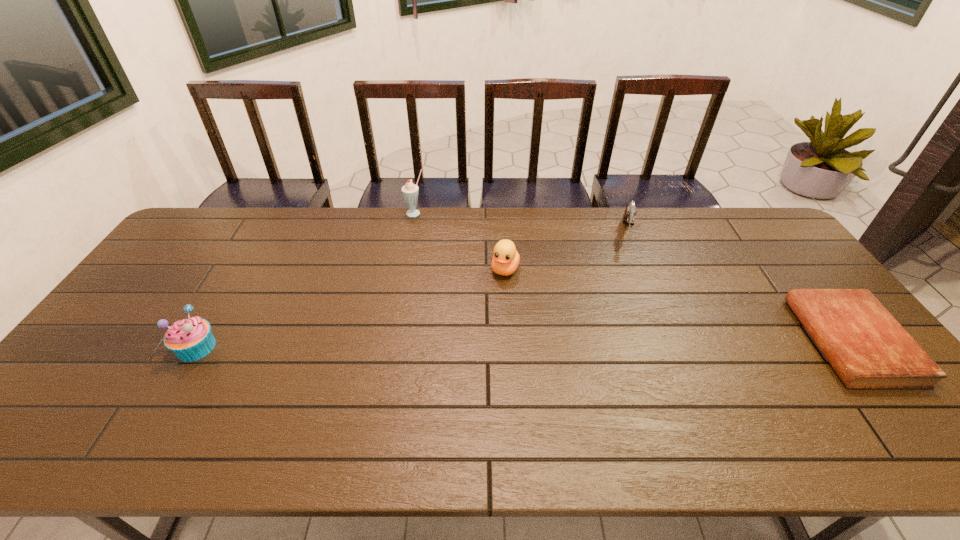
Image resolution: width=960 pixels, height=540 pixels. Identify the location of vacant region located on the spine side of the rightmost object. [683, 341].

Find the location of a particular element. free space located 0.070m on the spine side of the rightmost object is located at coordinates (783, 341).

Locate an element on the screen. The width and height of the screenshot is (960, 540). vacant space located on the straw side of the milkshake is located at coordinates (434, 265).

The height and width of the screenshot is (540, 960). What are the coordinates of `free space located on the straw side of the milkshake` in the screenshot? It's located at (443, 291).

The height and width of the screenshot is (540, 960). I want to click on vacant area situated on the straw side of the milkshake, so click(442, 286).

At what (x,y) coordinates should I click in order to perform the action: click on free space located 0.390m at the barrel of the pistol. Please return your answer as a coordinate pair (x, y). This screenshot has width=960, height=540. Looking at the image, I should click on (629, 336).

Identify the location of free spot located 0.190m at the barrel of the pistol. (630, 286).

Where is `vacant space located at the barrel of the pistol`? vacant space located at the barrel of the pistol is located at coordinates (630, 305).

The image size is (960, 540). What are the coordinates of `free space located 0.210m on the face of the third object from left to right` in the screenshot? It's located at (481, 332).

Find the location of a particular element. Image resolution: width=960 pixels, height=540 pixels. free location located on the face of the third object from left to right is located at coordinates (460, 386).